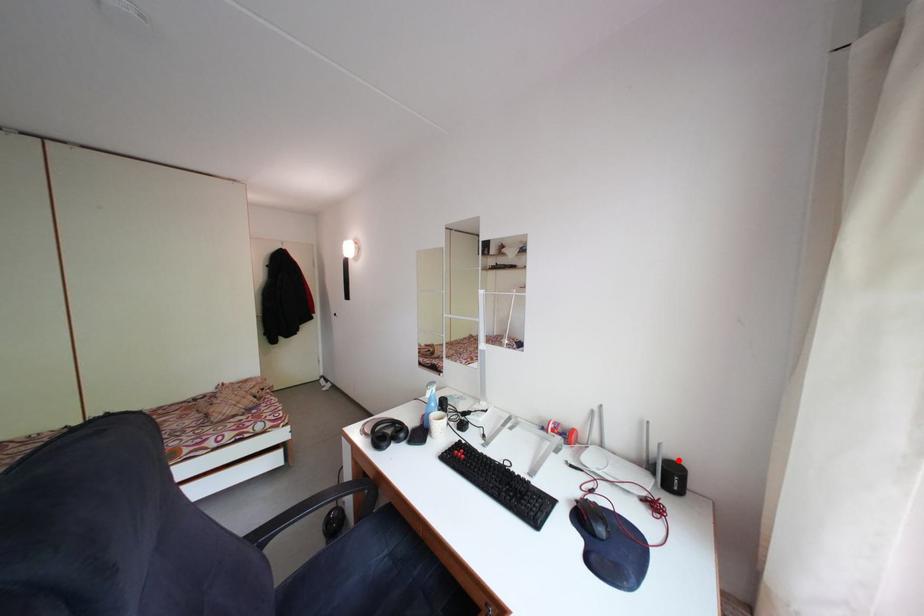
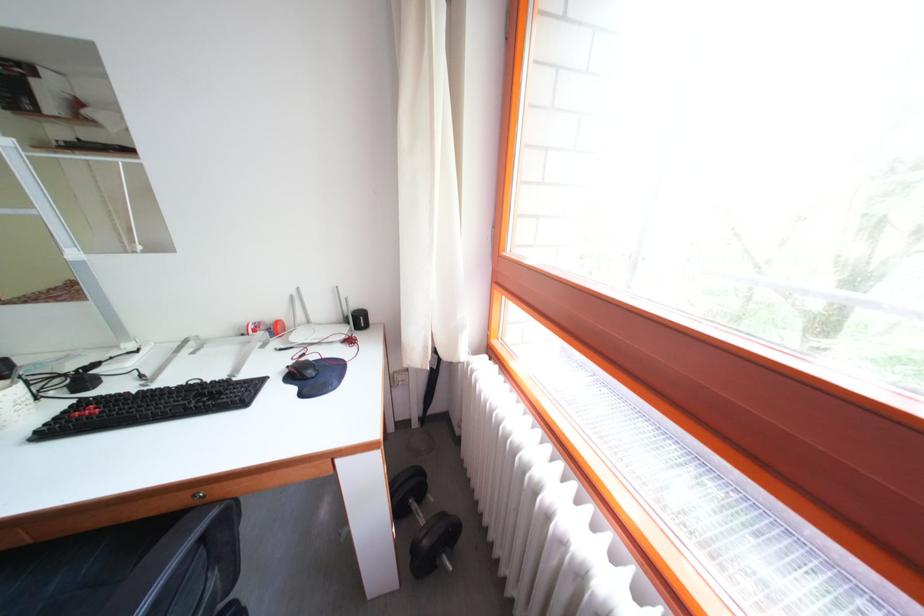
In the second image, find the point that corresponds to the highlighted location in the first image.

(365, 312)